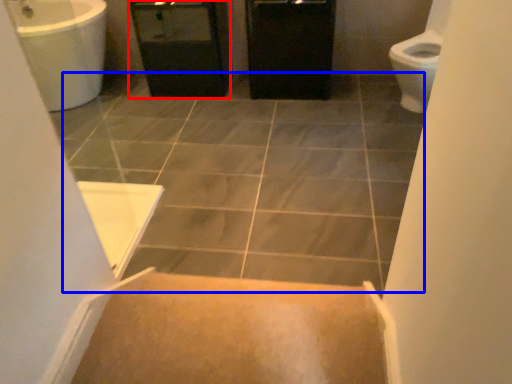
Question: Which of the following is the farthest to the observer, screen door (highlighted by a red box) or ceramic tile (highlighted by a blue box)?

Choices:
 (A) screen door
 (B) ceramic tile

Answer: (A)